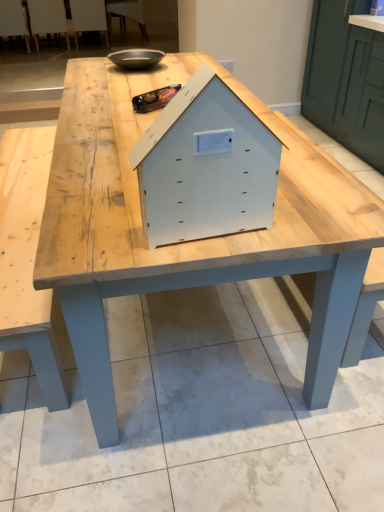
Question: In terms of width, does white plastic chair at upper left, which is counted as the 3th chair, starting from the left, look wider or thinner when compared to white matte wooden house at center?

Choices:
 (A) wide
 (B) thin

Answer: (A)

Question: Based on their sizes in the image, would you say white plastic chair at upper left, which is counted as the 3th chair, starting from the left, is bigger or smaller than white matte wooden house at center?

Choices:
 (A) big
 (B) small

Answer: (A)

Question: Which is nearer to the white plastic chair at upper left, which is counted as the 3th chair, starting from the left?

Choices:
 (A) light wood table at center
 (B) white plastic chair at upper left, which ranks as the 2th chair in left-to-right order
 (C) white plastic chair at upper center, which ranks as the 1th chair in right-to-left order
 (D) matte black bowl at upper center
 (E) white matte wooden house at center

Answer: (B)

Question: Which object is the closest to the white plastic chair at upper center, which is counted as the 4th chair, starting from the left?

Choices:
 (A) matte black bowl at upper center
 (B) white plastic chair at upper left, the 3th chair from the right
 (C) wooden chair at upper left, the fourth chair in the right-to-left sequence
 (D) light wood table at center
 (E) white matte wooden house at center

Answer: (B)